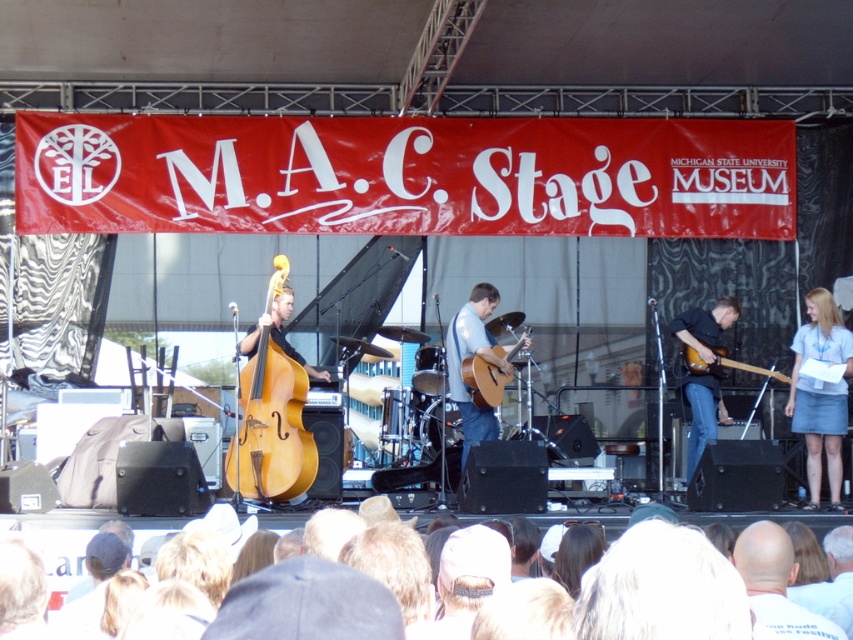
Question: Based on their relative distances, which object is farther from the denim skirt at right?

Choices:
 (A) light brown wood upright bass at center
 (B) bald head at center

Answer: (B)

Question: Which point appears closest to the camera in this image?

Choices:
 (A) (798, 426)
 (B) (281, 298)
 (C) (492, 412)

Answer: (B)

Question: Is the position of white cotton crowd at lower center more distant than that of glossy wood electric guitar at right?

Choices:
 (A) no
 (B) yes

Answer: (A)

Question: Where is wooden acoustic guitar at center located in relation to glossy wood electric guitar at right in the image?

Choices:
 (A) right
 (B) left

Answer: (B)

Question: Among these objects, which one is farthest from the camera?

Choices:
 (A) white cotton crowd at lower center
 (B) wooden acoustic guitar at center

Answer: (B)

Question: Is light brown wood upright bass at center to the right of bald head at center from the viewer's perspective?

Choices:
 (A) yes
 (B) no

Answer: (B)